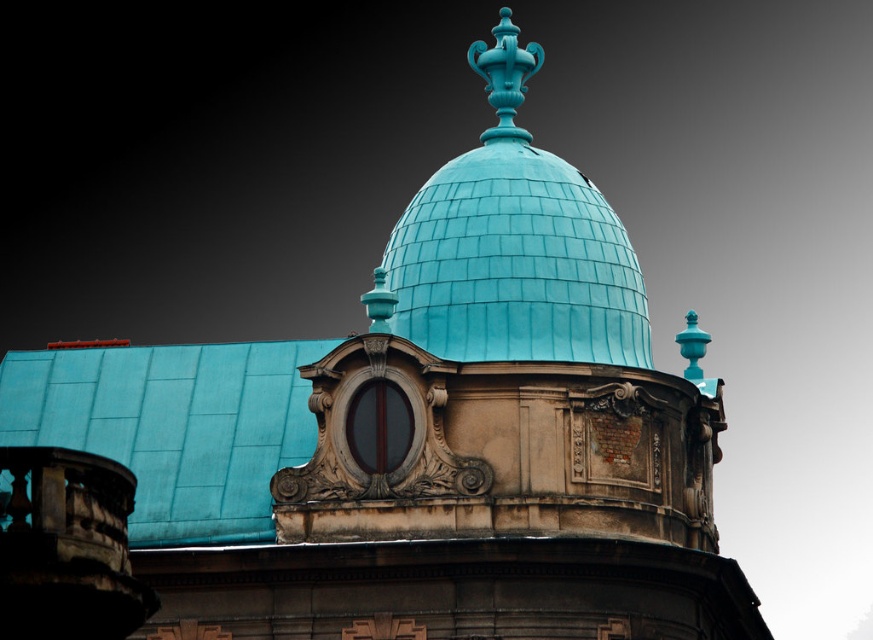
Between point (420, 240) and point (505, 99), which one is positioned in front?

Positioned in front is point (420, 240).

How much distance is there between teal shingled dome at center and matte turquoise vase at center?

teal shingled dome at center and matte turquoise vase at center are 17.33 feet apart from each other.

Image resolution: width=873 pixels, height=640 pixels. In order to click on teal shingled dome at center in this screenshot , I will do `click(514, 246)`.

Identify the location of teal shingled dome at center. (514, 246).